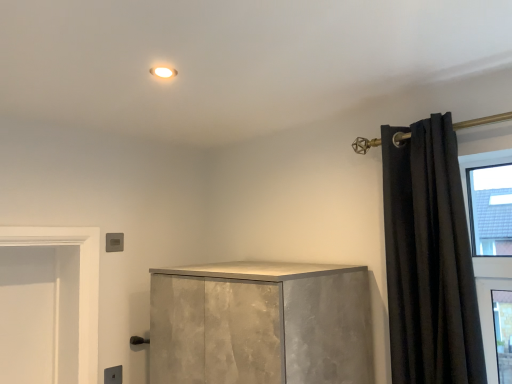
Question: Considering their positions, is matte gray electric outlet at lower left located in front of or behind black velvet curtain at right?

Choices:
 (A) front
 (B) behind

Answer: (B)

Question: Is matte gray electric outlet at lower left wider or thinner than black velvet curtain at right?

Choices:
 (A) wide
 (B) thin

Answer: (B)

Question: Considering the positions of matte gray electric outlet at lower left and black velvet curtain at right in the image, is matte gray electric outlet at lower left bigger or smaller than black velvet curtain at right?

Choices:
 (A) big
 (B) small

Answer: (B)

Question: Considering the positions of black velvet curtain at right and matte gray electric outlet at lower left in the image, is black velvet curtain at right bigger or smaller than matte gray electric outlet at lower left?

Choices:
 (A) small
 (B) big

Answer: (B)

Question: In the image, is black velvet curtain at right positioned in front of or behind matte gray electric outlet at lower left?

Choices:
 (A) front
 (B) behind

Answer: (A)

Question: Is black velvet curtain at right spatially inside matte gray electric outlet at lower left, or outside of it?

Choices:
 (A) inside
 (B) outside

Answer: (B)

Question: From their relative heights in the image, would you say black velvet curtain at right is taller or shorter than matte gray electric outlet at lower left?

Choices:
 (A) short
 (B) tall

Answer: (B)